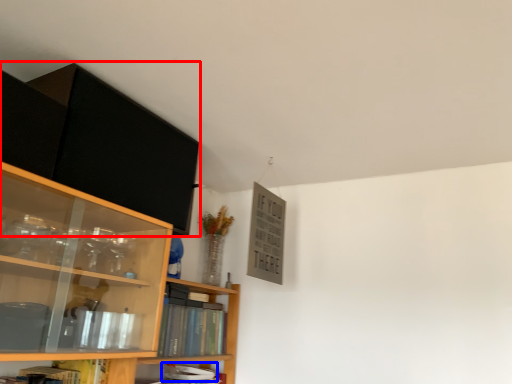
Question: Which object is further to the camera taking this photo, cabinetry (highlighted by a red box) or book (highlighted by a blue box)?

Choices:
 (A) cabinetry
 (B) book

Answer: (B)